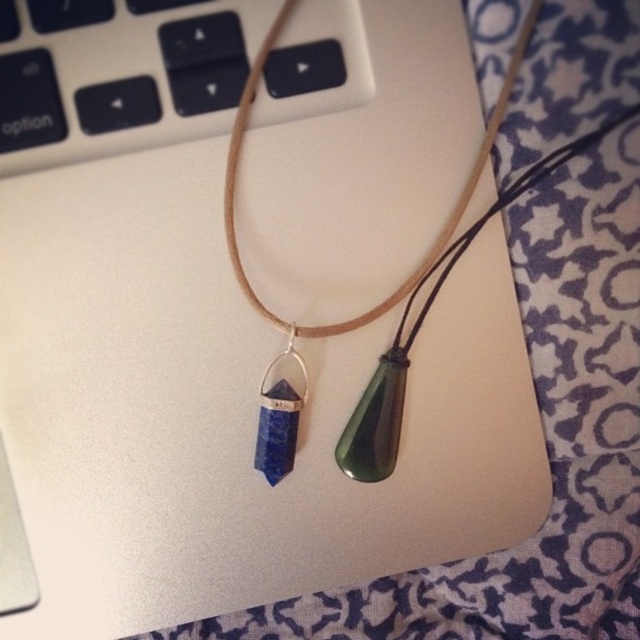
Question: Which point is closer to the camera?

Choices:
 (A) (120, 48)
 (B) (252, 97)
 (C) (262, 385)

Answer: (A)

Question: Estimate the real-world distances between objects in this image. Which object is closer to the lapis lazuli stone at center?

Choices:
 (A) white plastic keyboard at upper left
 (B) green polished stone pendant at center

Answer: (B)

Question: Does white plastic keyboard at upper left appear over lapis lazuli stone at center?

Choices:
 (A) no
 (B) yes

Answer: (B)

Question: Which point appears closest to the camera in this image?

Choices:
 (A) (490, 124)
 (B) (260, 388)

Answer: (A)

Question: Can you confirm if white plastic keyboard at upper left is positioned below green polished stone pendant at center?

Choices:
 (A) yes
 (B) no

Answer: (B)

Question: Does white plastic keyboard at upper left lie in front of green polished stone pendant at center?

Choices:
 (A) no
 (B) yes

Answer: (B)